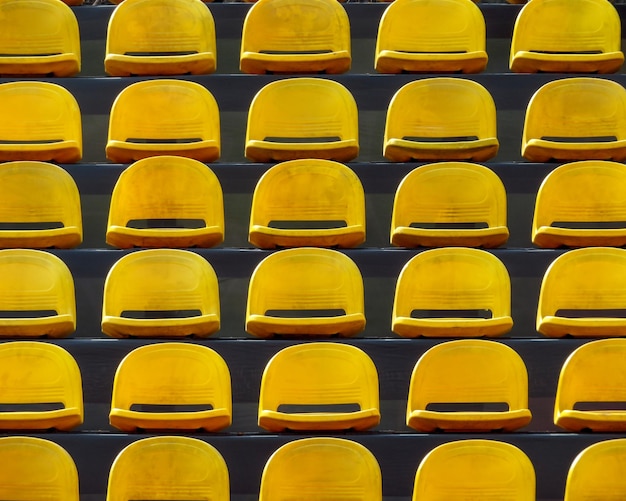
What are the coordinates of `seats located 3rd row from the top` in the screenshot? It's located at (28, 200), (143, 200), (298, 187), (457, 196), (567, 196).